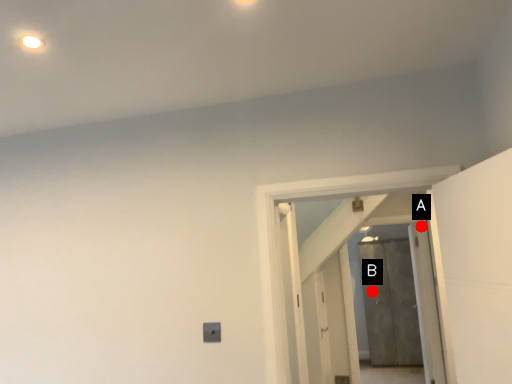
Question: Two points are circled on the image, labeled by A and B beside each circle. Which point is closer to the camera?

Choices:
 (A) A is closer
 (B) B is closer

Answer: (A)